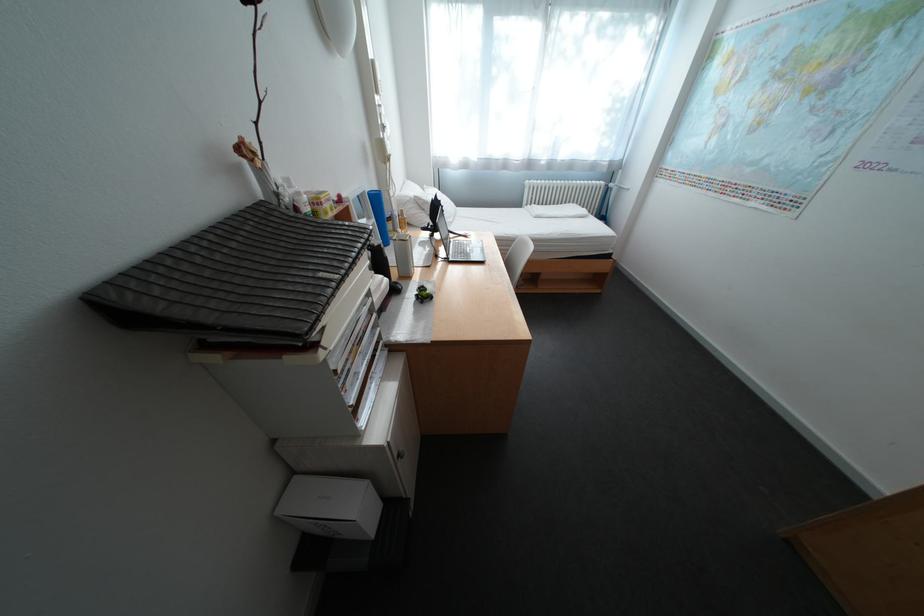
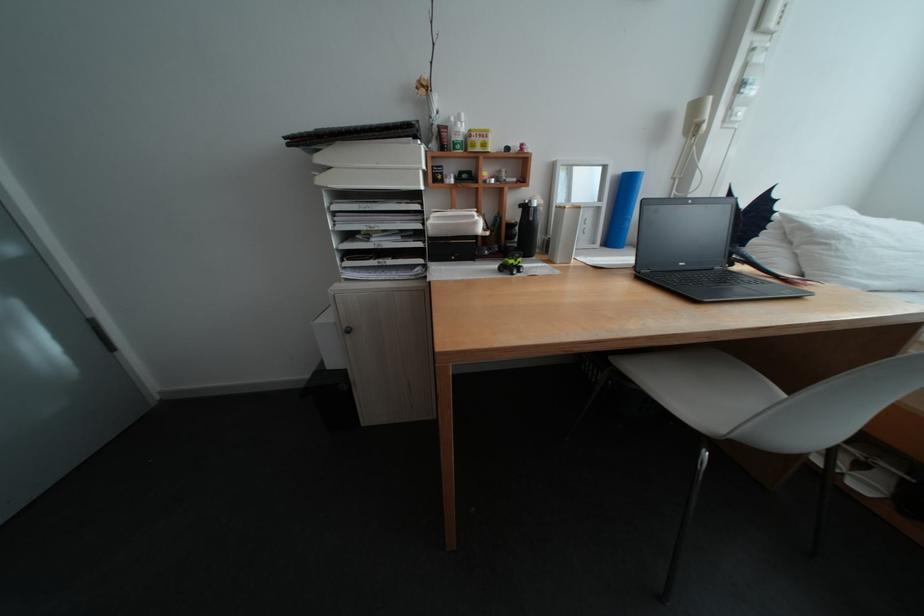
In the second image, find the point that corresponds to pixel 335 201 in the first image.

(485, 135)